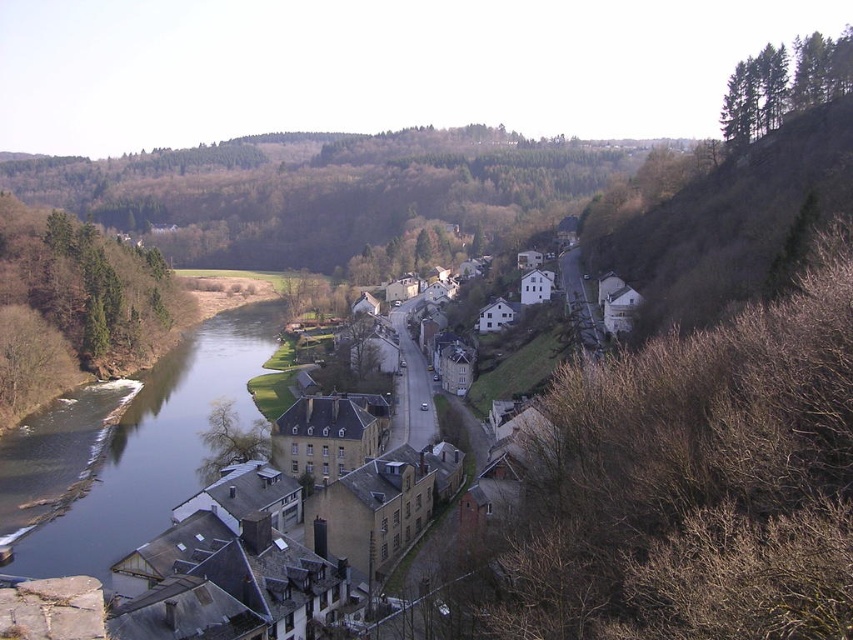
Question: From the image, what is the correct spatial relationship of brown leafless tree at lower right in relation to bare soil at upper right?

Choices:
 (A) left
 (B) right

Answer: (A)

Question: Which of the following is the closest to the observer?

Choices:
 (A) (804, 61)
 (B) (236, 515)
 (C) (555, 480)
 (D) (229, 458)

Answer: (C)

Question: Considering the relative positions of yellow stone buildings at center and green leafy tree at lower left in the image provided, where is yellow stone buildings at center located with respect to green leafy tree at lower left?

Choices:
 (A) left
 (B) right

Answer: (B)

Question: Which point is closer to the camera?

Choices:
 (A) (209, 534)
 (B) (639, 220)
 (C) (735, 108)

Answer: (A)

Question: Does brown leafless tree at lower right have a greater width compared to green leafy tree at lower left?

Choices:
 (A) yes
 (B) no

Answer: (A)

Question: Which is farther from the smooth concrete river at left?

Choices:
 (A) green leafy tree at lower left
 (B) green leafy trees at upper right

Answer: (B)